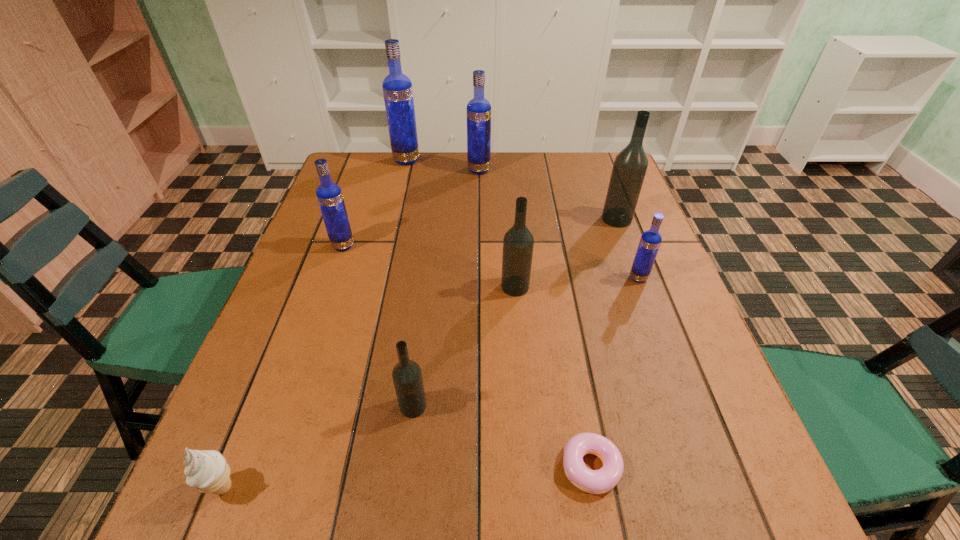
Image resolution: width=960 pixels, height=540 pixels. Find the location of `the tallest object`. the tallest object is located at coordinates (397, 88).

This screenshot has height=540, width=960. Identify the location of the sixth vodka from right to left. (397, 88).

Locate an element on the screen. the second blue vodka from right to left is located at coordinates (478, 111).

The height and width of the screenshot is (540, 960). What are the coordinates of `the fourth vodka from right to left` in the screenshot? It's located at (478, 111).

The height and width of the screenshot is (540, 960). I want to click on the rightmost black vodka, so click(630, 165).

Locate an element on the screen. This screenshot has width=960, height=540. the biggest black vodka is located at coordinates (630, 165).

What are the coordinates of `the fourth farthest object` in the screenshot? It's located at (329, 195).

Identify the location of the fourth farthest vodka. This screenshot has height=540, width=960. (329, 195).

In order to click on the fifth vodka from left to right in this screenshot , I will do `click(518, 242)`.

This screenshot has width=960, height=540. Find the location of `the second biggest black vodka`. the second biggest black vodka is located at coordinates (518, 242).